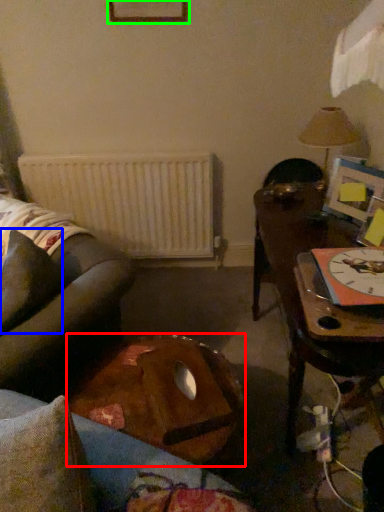
Question: Which object is the farthest from table (highlighted by a red box)? Choose among these: pillow (highlighted by a blue box) or picture frame (highlighted by a green box).

Choices:
 (A) pillow
 (B) picture frame

Answer: (B)